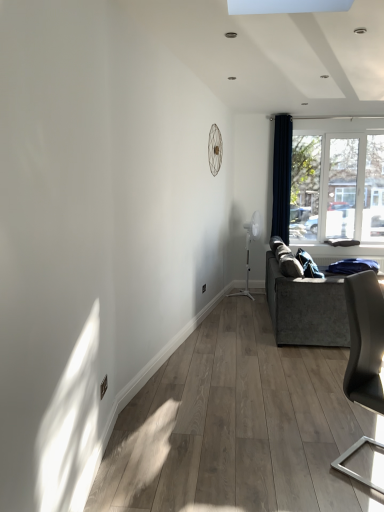
Question: In the image, is velvet grey couch at right positioned in front of or behind white plastic window at right?

Choices:
 (A) front
 (B) behind

Answer: (A)

Question: Would you say velvet grey couch at right is inside or outside white plastic window at right?

Choices:
 (A) outside
 (B) inside

Answer: (A)

Question: Considering the real-world distances, which object is farthest from the navy blue velvet curtain at right?

Choices:
 (A) white plastic window at right
 (B) matte gray chair at right
 (C) velvet grey couch at right

Answer: (B)

Question: Estimate the real-world distances between objects in this image. Which object is closer to the matte gray chair at right?

Choices:
 (A) navy blue velvet curtain at right
 (B) velvet grey couch at right
 (C) white plastic window at right

Answer: (B)